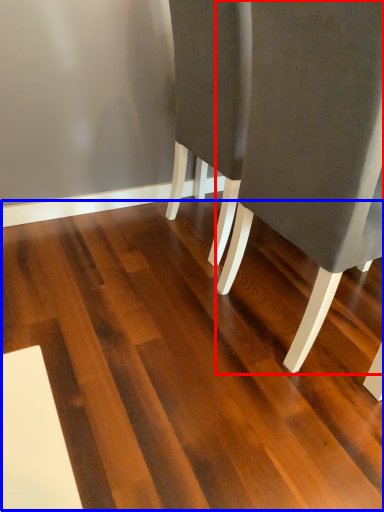
Question: Which object is closer to the camera taking this photo, chair (highlighted by a red box) or hardwood (highlighted by a blue box)?

Choices:
 (A) chair
 (B) hardwood

Answer: (B)